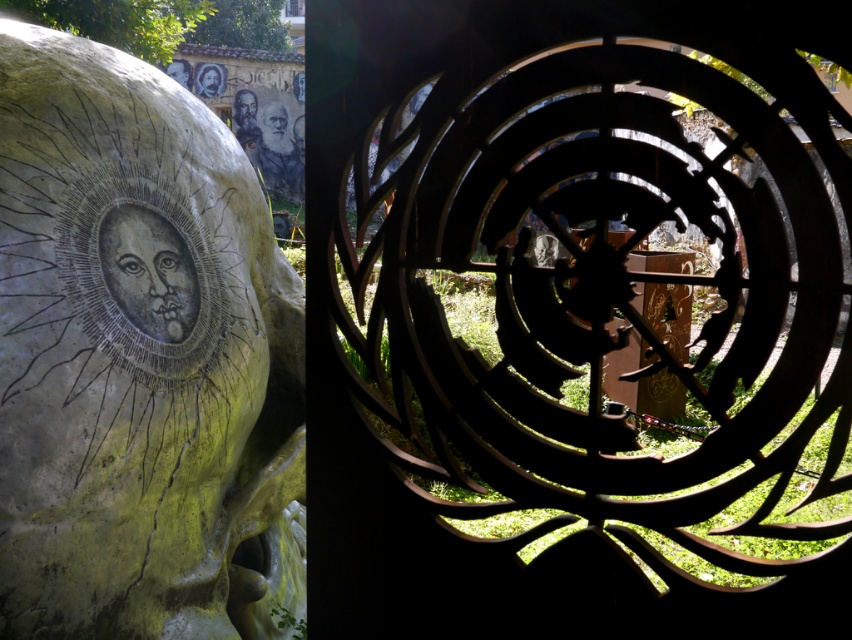
Is matte stone face at center bigger than gray textured face at upper center?

Incorrect, matte stone face at center is not larger than gray textured face at upper center.

Is point (133, 317) more distant than point (286, 122)?

That is False.

At what (x,y) coordinates should I click in order to perform the action: click on matte stone face at center. Please return your answer as a coordinate pair (x, y). Looking at the image, I should click on (148, 272).

Is greenish stone skull at left taller than matte black face at upper center?

Yes.

How much distance is there between greenish stone skull at left and matte black face at upper center?

greenish stone skull at left and matte black face at upper center are 9.65 meters apart from each other.

Image resolution: width=852 pixels, height=640 pixels. Describe the element at coordinates (139, 358) in the screenshot. I see `greenish stone skull at left` at that location.

Locate an element on the screen. The width and height of the screenshot is (852, 640). greenish stone skull at left is located at coordinates (139, 358).

Is point (265, 122) positioned before point (255, 97)?

Yes, point (265, 122) is closer to viewer.

From the picture: Is gray textured face at upper center further to the viewer compared to matte black face at upper center?

Yes, it is behind matte black face at upper center.

Who is more forward, (275, 144) or (232, 116)?

Positioned in front is point (232, 116).

You are a GUI agent. You are given a task and a screenshot of the screen. Output one action in this format:
    pyautogui.click(x=<x>, y=<y>)
    Task: Click on the gray textured face at upper center
    
    Given the screenshot: What is the action you would take?
    pyautogui.click(x=275, y=129)